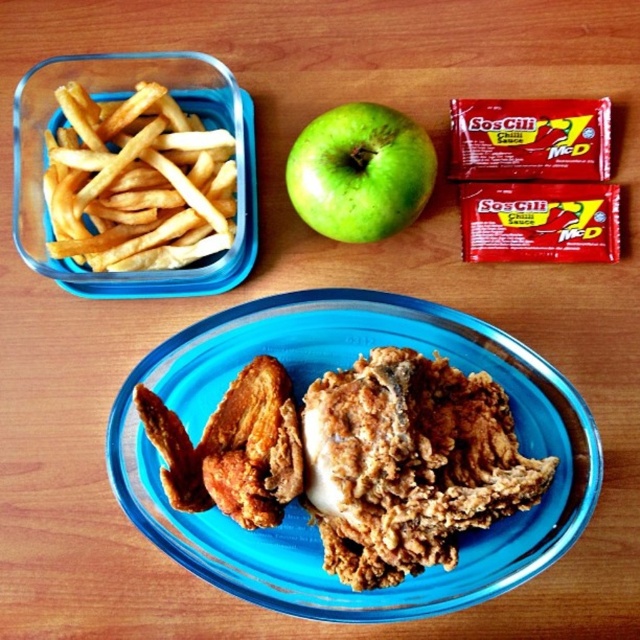
You are a food delivery person who needs to place the yellow crispy french fries at left and the green matte apple at center into a delivery box. The box has a height limit of 15 cm. Can you fit both items vertically without bending them?

The yellow crispy french fries at left is bigger than the green matte apple at center. Since the height limit is 15 cm, if the taller item is within this limit, both can fit. However, without specific height measurements, we cannot confirm. Please check the actual height of the yellow crispy french fries at left.

You are a food delivery person who needs to pick up the yellow crispy french fries at left and the green matte apple at center from the wooden table. The delivery person has a small tray that can only hold one item at a time. Which item should you pick up first to avoid blocking the other item?

You should pick up the yellow crispy french fries at left first because it is positioned under the green matte apple at center. By removing the fries first, you won not block the apple, which is above it.